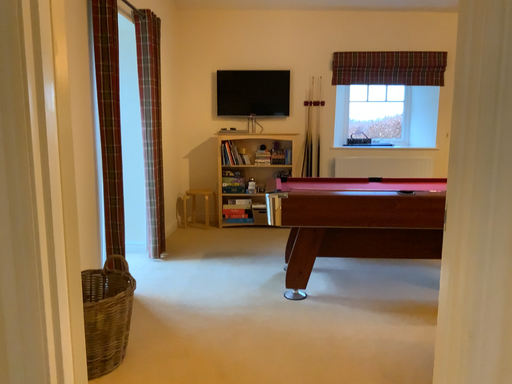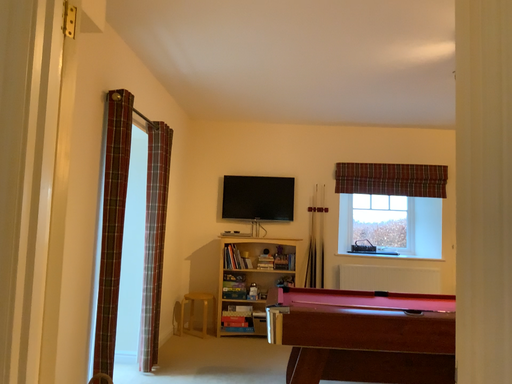
Question: Which way did the camera rotate in the video?

Choices:
 (A) rotated upward
 (B) rotated downward

Answer: (A)